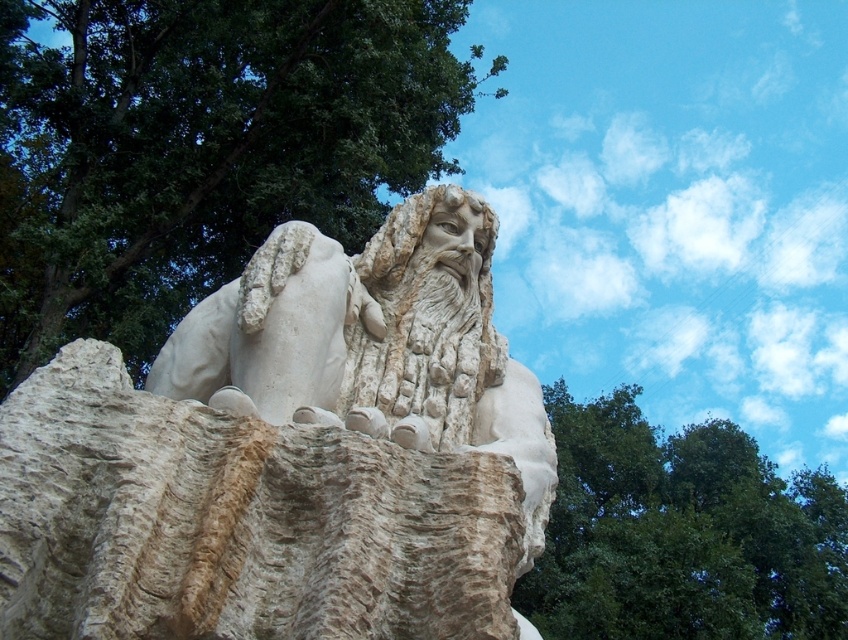
The width and height of the screenshot is (848, 640). What do you see at coordinates (201, 148) in the screenshot?
I see `green leafy tree at upper left` at bounding box center [201, 148].

Is green leafy tree at upper left below green leafy tree at upper right?

No.

Between point (187, 84) and point (637, 499), which one is positioned in front?

Point (187, 84) is more forward.

At what (x,y) coordinates should I click in order to perform the action: click on green leafy tree at upper left. Please return your answer as a coordinate pair (x, y). This screenshot has height=640, width=848. Looking at the image, I should click on (201, 148).